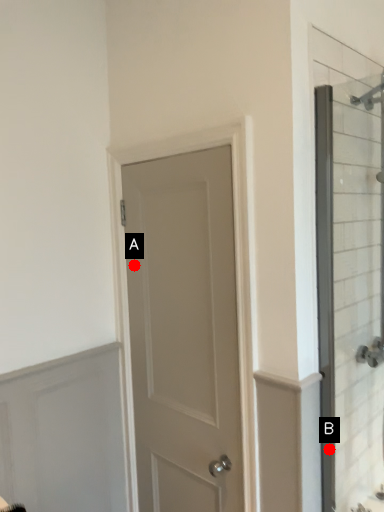
Question: Two points are circled on the image, labeled by A and B beside each circle. Which point is farther to the camera?

Choices:
 (A) A is further
 (B) B is further

Answer: (A)